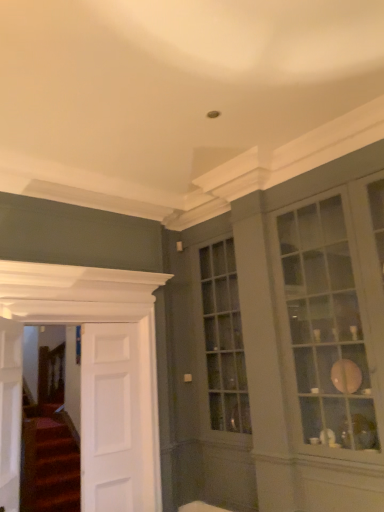
What do you see at coordinates (110, 418) in the screenshot? I see `white smooth door at left, which is counted as the 1th door, starting from the right` at bounding box center [110, 418].

Image resolution: width=384 pixels, height=512 pixels. What do you see at coordinates (336, 315) in the screenshot?
I see `matte glass cabinet at right` at bounding box center [336, 315].

What do you see at coordinates (10, 412) in the screenshot? I see `white wooden door at left, placed as the first door when sorted from left to right` at bounding box center [10, 412].

At what (x,y) coordinates should I click in order to perform the action: click on white smooth door at left, acting as the third door starting from the left. Please return your answer as a coordinate pair (x, y). Looking at the image, I should click on (110, 418).

Which is closer to the camera, (114, 442) or (320, 205)?

Point (114, 442) is positioned farther from the camera compared to point (320, 205).

Can you confirm if white smooth door at left, which is counted as the 1th door, starting from the right, is thinner than matte glass cabinet at right?

Yes.

Which object is positioned more to the left, white wooden door at left, marked as the 3th door in a right-to-left arrangement, or matte glass cabinet at right?

white wooden door at left, marked as the 3th door in a right-to-left arrangement.

There is a white wooden door at left, marked as the 3th door in a right-to-left arrangement. What are the coordinates of `window above it (from a real-world perspective)` in the screenshot? It's located at (336, 315).

Is point (3, 322) more distant than point (306, 329)?

That is False.

Image resolution: width=384 pixels, height=512 pixels. In order to click on the 1st door behind the white wooden door at left, marked as the 3th door in a right-to-left arrangement, counting from the anchor's position in this screenshot , I will do `click(96, 322)`.

Does white wooden door at left, placed as the second door when sorted from right to left, have a greater width compared to white wooden door at left, marked as the 3th door in a right-to-left arrangement?

No, white wooden door at left, placed as the second door when sorted from right to left, is not wider than white wooden door at left, marked as the 3th door in a right-to-left arrangement.

Does white wooden door at left, placed as the second door when sorted from right to left, have a larger size compared to white wooden door at left, marked as the 3th door in a right-to-left arrangement?

Yes.

Considering the points (74, 289) and (10, 458), which point is behind, point (74, 289) or point (10, 458)?

The point (74, 289) is behind.

Which is more to the right, white wooden door at left, placed as the second door when sorted from right to left, or white smooth door at left, acting as the third door starting from the left?

Positioned to the right is white smooth door at left, acting as the third door starting from the left.

Considering their positions, is white wooden door at left, placed as the second door when sorted from right to left, located in front of or behind white smooth door at left, acting as the third door starting from the left?

Clearly, white wooden door at left, placed as the second door when sorted from right to left, is in front of white smooth door at left, acting as the third door starting from the left.

Which of these two, white wooden door at left, which is counted as the second door, starting from the left, or white smooth door at left, acting as the third door starting from the left, is bigger?

With larger size is white wooden door at left, which is counted as the second door, starting from the left.

Locate an element on the screen. the 1st door in front of the white smooth door at left, which is counted as the 1th door, starting from the right, counting from the anchor's position is located at coordinates (96, 322).

From the picture: Considering the positions of objects matte glass cabinet at right and white wooden door at left, placed as the first door when sorted from left to right, in the image provided, who is more to the left, matte glass cabinet at right or white wooden door at left, placed as the first door when sorted from left to right,?

From the viewer's perspective, white wooden door at left, placed as the first door when sorted from left to right, appears more on the left side.

Is matte glass cabinet at right positioned before white wooden door at left, marked as the 3th door in a right-to-left arrangement?

Yes.

Considering the positions of point (360, 416) and point (9, 493), is point (360, 416) closer or farther from the camera than point (9, 493)?

Point (360, 416).

From a real-world perspective, which object stands above the other?

matte glass cabinet at right, from a real-world perspective.

In terms of size, does white wooden door at left, marked as the 3th door in a right-to-left arrangement, appear bigger or smaller than white smooth door at left, which is counted as the 1th door, starting from the right?

In the image, white wooden door at left, marked as the 3th door in a right-to-left arrangement, appears to be larger than white smooth door at left, which is counted as the 1th door, starting from the right.

From the image's perspective, is white wooden door at left, marked as the 3th door in a right-to-left arrangement, above or below white smooth door at left, which is counted as the 1th door, starting from the right?

white wooden door at left, marked as the 3th door in a right-to-left arrangement, is situated higher than white smooth door at left, which is counted as the 1th door, starting from the right, in the image.

From a real-world perspective, is white wooden door at left, placed as the first door when sorted from left to right, below white smooth door at left, acting as the third door starting from the left?

No, from a real-world perspective, white wooden door at left, placed as the first door when sorted from left to right, is not under white smooth door at left, acting as the third door starting from the left.

Is white wooden door at left, marked as the 3th door in a right-to-left arrangement, looking in the opposite direction of white smooth door at left, acting as the third door starting from the left?

No, white wooden door at left, marked as the 3th door in a right-to-left arrangement,'s orientation is not away from white smooth door at left, acting as the third door starting from the left.

Is white smooth door at left, acting as the third door starting from the left, located outside white wooden door at left, placed as the second door when sorted from right to left?

No, white smooth door at left, acting as the third door starting from the left, is not outside of white wooden door at left, placed as the second door when sorted from right to left.

In the scene shown: Which point is more forward, (93, 333) or (78, 273)?

Positioned in front is point (78, 273).

Does white smooth door at left, acting as the third door starting from the left, turn towards white wooden door at left, which is counted as the second door, starting from the left?

Yes.

In the scene shown: Considering the relative sizes of white smooth door at left, acting as the third door starting from the left, and white wooden door at left, which is counted as the second door, starting from the left, in the image provided, is white smooth door at left, acting as the third door starting from the left, wider than white wooden door at left, which is counted as the second door, starting from the left,?

Correct, the width of white smooth door at left, acting as the third door starting from the left, exceeds that of white wooden door at left, which is counted as the second door, starting from the left.

The image size is (384, 512). I want to click on window in front of the white smooth door at left, which is counted as the 1th door, starting from the right, so click(x=336, y=315).

Locate an element on the screen. window above the white wooden door at left, placed as the first door when sorted from left to right (from the image's perspective) is located at coordinates (336, 315).

Based on their spatial positions, is matte glass cabinet at right or white wooden door at left, which is counted as the second door, starting from the left, closer to white smooth door at left, which is counted as the 1th door, starting from the right?

Based on the image, white wooden door at left, which is counted as the second door, starting from the left, appears to be nearer to white smooth door at left, which is counted as the 1th door, starting from the right.

When comparing their distances from white smooth door at left, which is counted as the 1th door, starting from the right, does white wooden door at left, placed as the first door when sorted from left to right, or matte glass cabinet at right seem closer?

Among the two, white wooden door at left, placed as the first door when sorted from left to right, is located nearer to white smooth door at left, which is counted as the 1th door, starting from the right.

From the image, which object appears to be nearer to white wooden door at left, placed as the first door when sorted from left to right, white wooden door at left, placed as the second door when sorted from right to left, or white smooth door at left, acting as the third door starting from the left?

Based on the image, white wooden door at left, placed as the second door when sorted from right to left, appears to be nearer to white wooden door at left, placed as the first door when sorted from left to right.

Looking at the image, which one is located further to white smooth door at left, which is counted as the 1th door, starting from the right, white wooden door at left, which is counted as the second door, starting from the left, or matte glass cabinet at right?

The object further to white smooth door at left, which is counted as the 1th door, starting from the right, is matte glass cabinet at right.

When comparing their distances from matte glass cabinet at right, does white wooden door at left, placed as the first door when sorted from left to right, or white wooden door at left, placed as the second door when sorted from right to left, seem further?

Based on the image, white wooden door at left, placed as the first door when sorted from left to right, appears to be further to matte glass cabinet at right.

In the scene shown: From the image, which object appears to be farther from white wooden door at left, which is counted as the second door, starting from the left, white smooth door at left, acting as the third door starting from the left, or white wooden door at left, placed as the first door when sorted from left to right?

white wooden door at left, placed as the first door when sorted from left to right.

Considering their positions, is matte glass cabinet at right positioned further to white wooden door at left, which is counted as the second door, starting from the left, than white wooden door at left, marked as the 3th door in a right-to-left arrangement?

Based on the image, matte glass cabinet at right appears to be further to white wooden door at left, which is counted as the second door, starting from the left.

Which object lies nearer to the anchor point white smooth door at left, acting as the third door starting from the left, white wooden door at left, placed as the first door when sorted from left to right, or white wooden door at left, placed as the second door when sorted from right to left?

Among the two, white wooden door at left, placed as the second door when sorted from right to left, is located nearer to white smooth door at left, acting as the third door starting from the left.

This screenshot has width=384, height=512. In order to click on door between white wooden door at left, placed as the second door when sorted from right to left, and matte glass cabinet at right, in the horizontal direction in this screenshot , I will do click(110, 418).

Identify the location of door located between white wooden door at left, marked as the 3th door in a right-to-left arrangement, and white smooth door at left, which is counted as the 1th door, starting from the right, in the depth direction. The width and height of the screenshot is (384, 512). (96, 322).